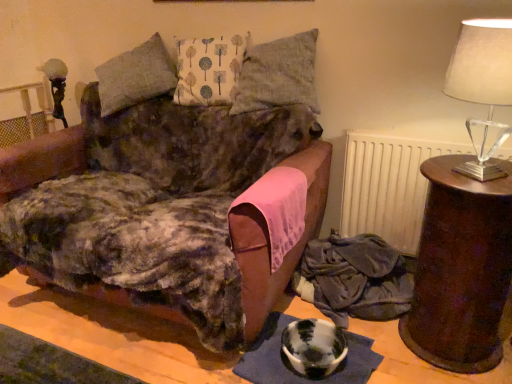
Where is `free space to the left of marble-like white bowl at lower center`? free space to the left of marble-like white bowl at lower center is located at coordinates (263, 357).